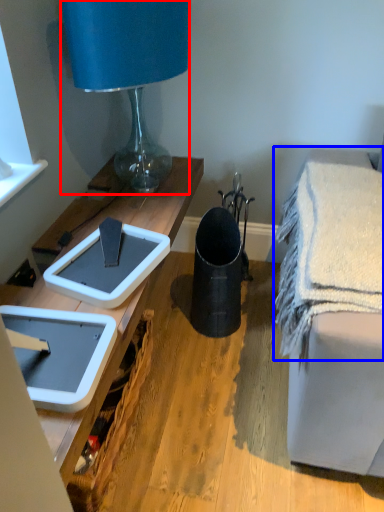
Question: Which object is further to the camera taking this photo, lamp (highlighted by a red box) or bath towel (highlighted by a blue box)?

Choices:
 (A) lamp
 (B) bath towel

Answer: (A)